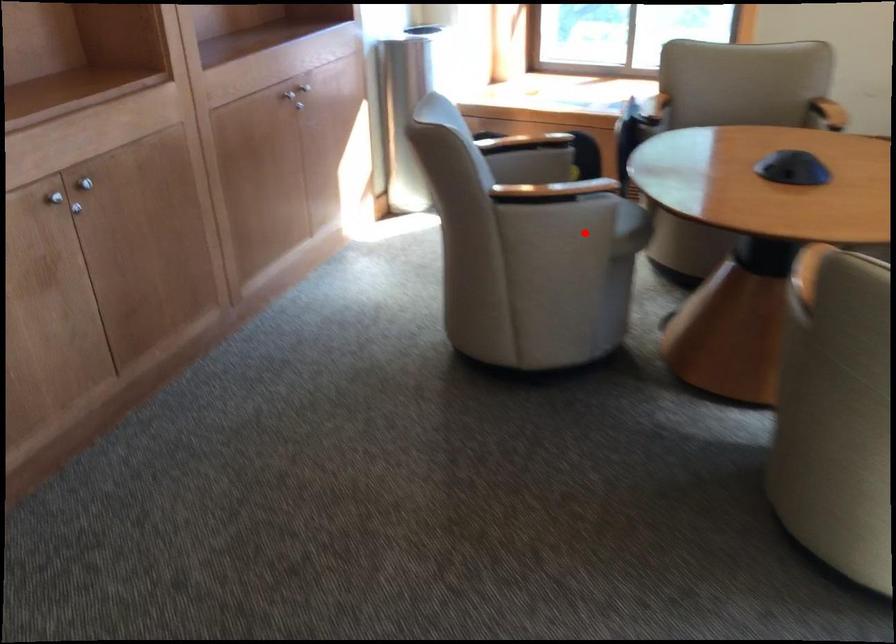
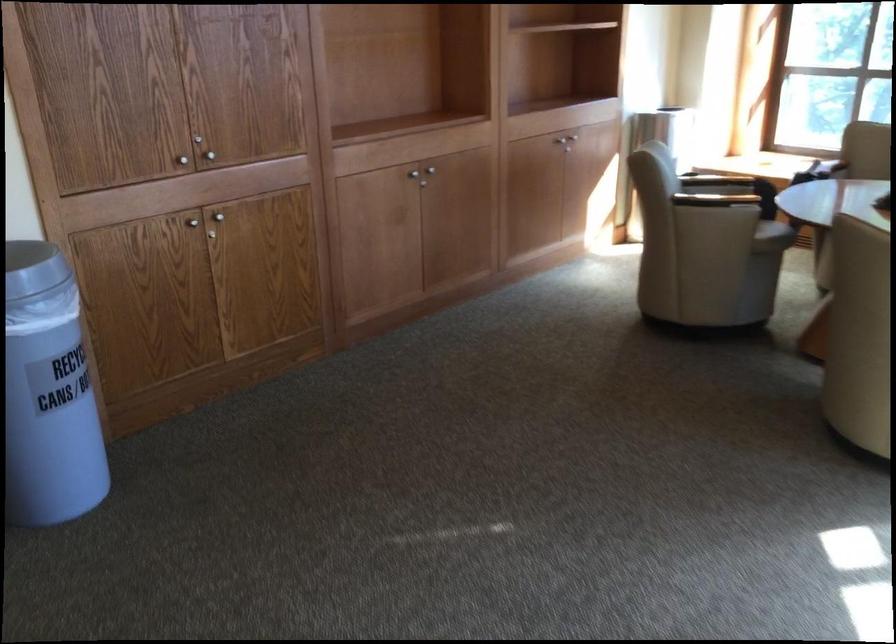
Locate, in the second image, the point that corresponds to the highlighted location in the first image.

(739, 225)